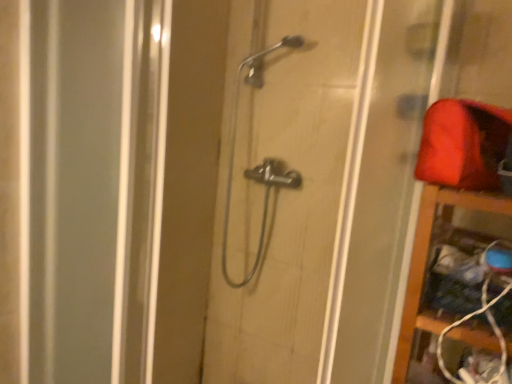
Where is `metallic showerhead at center`? This screenshot has height=384, width=512. metallic showerhead at center is located at coordinates (325, 195).

This screenshot has width=512, height=384. What do you see at coordinates (257, 165) in the screenshot? I see `polished chrome shower at center` at bounding box center [257, 165].

Locate an element on the screen. The width and height of the screenshot is (512, 384). matte red fabric at upper right is located at coordinates (463, 144).

From a real-world perspective, is polished chrome shower at center below wooden shelf at right?

No, from a real-world perspective, polished chrome shower at center is not under wooden shelf at right.

Considering the relative sizes of polished chrome shower at center and wooden shelf at right in the image provided, is polished chrome shower at center wider than wooden shelf at right?

No.

Looking at this image, considering the positions of objects polished chrome shower at center and wooden shelf at right in the image provided, who is more to the right, polished chrome shower at center or wooden shelf at right?

wooden shelf at right.

The image size is (512, 384). I want to click on shower positioned vertically above the wooden shelf at right (from a real-world perspective), so click(x=257, y=165).

From the image's perspective, is metallic showerhead at center above or below wooden shelf at right?

metallic showerhead at center is situated higher than wooden shelf at right in the image.

Measure the distance from metallic showerhead at center to wooden shelf at right.

They are 29.36 inches apart.

Who is smaller, metallic showerhead at center or wooden shelf at right?

wooden shelf at right is smaller.

How many degrees apart are the facing directions of metallic showerhead at center and wooden shelf at right?

6.54e-05 degrees separate the facing orientations of metallic showerhead at center and wooden shelf at right.

Is metallic showerhead at center taller than matte red fabric at upper right?

Yes.

From a real-world perspective, is metallic showerhead at center over matte red fabric at upper right?

Incorrect, from a real-world perspective, metallic showerhead at center is lower than matte red fabric at upper right.

From the image's perspective, relative to matte red fabric at upper right, is metallic showerhead at center above or below?

Clearly, from the image's perspective, metallic showerhead at center is below matte red fabric at upper right.

Is metallic showerhead at center a part of wooden shelf at right?

Actually, metallic showerhead at center is outside wooden shelf at right.

Does wooden shelf at right turn towards metallic showerhead at center?

No, wooden shelf at right is not oriented towards metallic showerhead at center.

Considering the relative positions of wooden shelf at right and metallic showerhead at center in the image provided, is wooden shelf at right to the right of metallic showerhead at center from the viewer's perspective?

Indeed, wooden shelf at right is positioned on the right side of metallic showerhead at center.

From the image's perspective, is wooden shelf at right located beneath metallic showerhead at center?

Correct, wooden shelf at right appears lower than metallic showerhead at center in the image.

Is matte red fabric at upper right beside metallic showerhead at center?

matte red fabric at upper right and metallic showerhead at center are not in contact.

Considering their positions, is matte red fabric at upper right located in front of or behind metallic showerhead at center?

Clearly, matte red fabric at upper right is behind metallic showerhead at center.

Locate an element on the screen. shower directly beneath the matte red fabric at upper right (from a real-world perspective) is located at coordinates (257, 165).

Is the position of matte red fabric at upper right less distant than that of polished chrome shower at center?

That is True.

How many degrees apart are the facing directions of matte red fabric at upper right and polished chrome shower at center?

matte red fabric at upper right and polished chrome shower at center are facing 0.189 degrees away from each other.

Is polished chrome shower at center at the back of matte red fabric at upper right?

No, matte red fabric at upper right is not facing the opposite direction of polished chrome shower at center.

Is point (258, 169) closer to camera compared to point (297, 51)?

No, (258, 169) is behind (297, 51).

Is polished chrome shower at center facing towards metallic showerhead at center?

Yes.

From the image's perspective, is polished chrome shower at center beneath metallic showerhead at center?

No, from the image's perspective, polished chrome shower at center is not below metallic showerhead at center.

Which object is positioned more to the left, polished chrome shower at center or metallic showerhead at center?

metallic showerhead at center is more to the left.

Where is `cabinet in front of the polished chrome shower at center`? Image resolution: width=512 pixels, height=384 pixels. cabinet in front of the polished chrome shower at center is located at coordinates (426, 255).

Identify the location of door located above the wooden shelf at right (from the image's perspective). click(x=325, y=195).

From the image, which object appears to be farther from wooden shelf at right, matte red fabric at upper right or polished chrome shower at center?

The object further to wooden shelf at right is polished chrome shower at center.

Consider the image. Considering their positions, is polished chrome shower at center positioned further to wooden shelf at right than metallic showerhead at center?

Based on the image, polished chrome shower at center appears to be further to wooden shelf at right.

Based on their spatial positions, is metallic showerhead at center or matte red fabric at upper right further from polished chrome shower at center?

Based on the image, matte red fabric at upper right appears to be further to polished chrome shower at center.

From the image, which object appears to be farther from matte red fabric at upper right, metallic showerhead at center or wooden shelf at right?

metallic showerhead at center lies further to matte red fabric at upper right than the other object.

From the image, which object appears to be farther from metallic showerhead at center, wooden shelf at right or polished chrome shower at center?

Among the two, wooden shelf at right is located further to metallic showerhead at center.

Based on their spatial positions, is wooden shelf at right or matte red fabric at upper right further from polished chrome shower at center?

wooden shelf at right is further to polished chrome shower at center.

Based on their spatial positions, is polished chrome shower at center or metallic showerhead at center closer to matte red fabric at upper right?

metallic showerhead at center is positioned closer to the anchor matte red fabric at upper right.

Considering their positions, is matte red fabric at upper right positioned closer to metallic showerhead at center than polished chrome shower at center?

Among the two, polished chrome shower at center is located nearer to metallic showerhead at center.

Image resolution: width=512 pixels, height=384 pixels. In order to click on material positioned between wooden shelf at right and polished chrome shower at center from near to far in this screenshot , I will do `click(463, 144)`.

In order to click on cabinet located between metallic showerhead at center and polished chrome shower at center in the depth direction in this screenshot , I will do `click(426, 255)`.

What are the coordinates of `material located between metallic showerhead at center and polished chrome shower at center in the depth direction` in the screenshot? It's located at [463, 144].

Where is `material between metallic showerhead at center and wooden shelf at right in the horizontal direction`? This screenshot has width=512, height=384. material between metallic showerhead at center and wooden shelf at right in the horizontal direction is located at coordinates (463, 144).